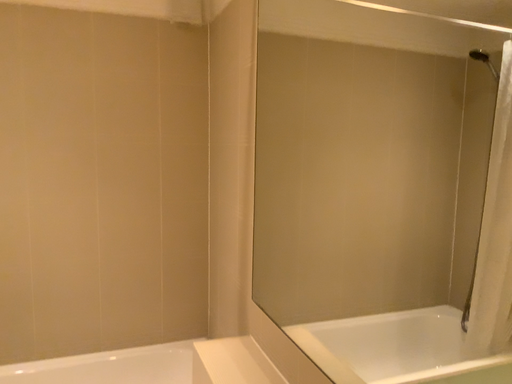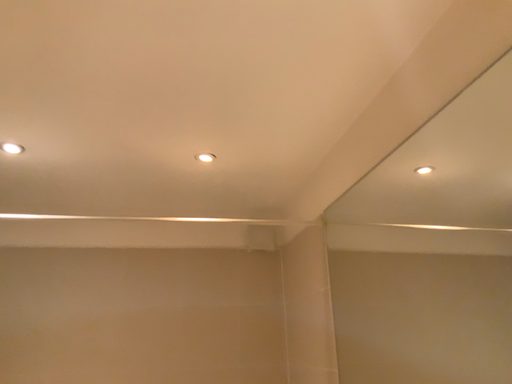
Question: Which way did the camera rotate in the video?

Choices:
 (A) rotated downward
 (B) rotated upward

Answer: (B)